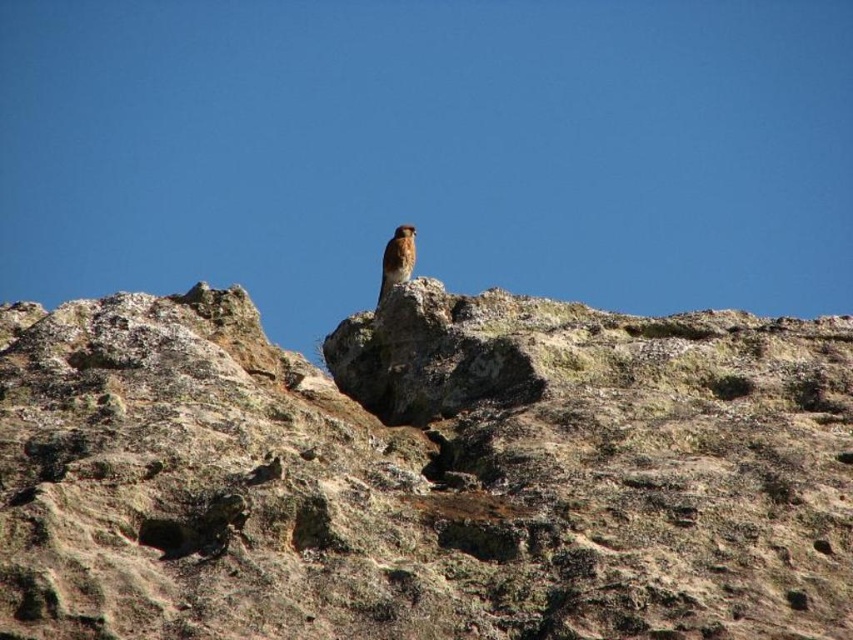
You are an ornithologist observing a bird in a rocky area. You notice a brown rough rock at upper center and rusty brown feathers at center. Which object is positioned higher in the image?

The rusty brown feathers at center are positioned higher than the brown rough rock at upper center because the brown rough rock at upper center is below rusty brown feathers at center.